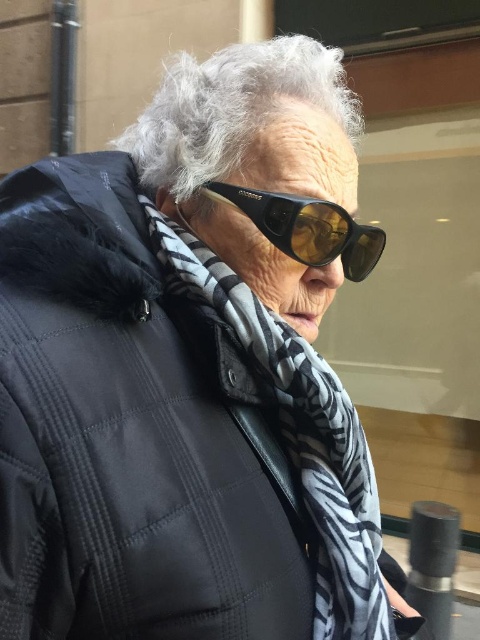
Where is the black and white patterned scarf at center located in the image?

The black and white patterned scarf at center is located at point (300, 436) in the image.

Looking at this image, in the image, there is an elderly person wearing a dark puffer jacket with a fur lined hood, a black and white scarf, and large dark sunglasses. The person has gray curly hair at upper center. You are a photographer who wants to take a close up shot of the person. To do so, you need to move closer to the point at (x=230, y=108). Is this point located on the gray curly hair at upper center?

→ Yes, the point at (x=230, y=108) is located on the gray curly hair at upper center as indicated by the description.

You are standing in a public space and want to know the distance between you and the point marked at coordinates (240,90) in the image. Can you determine this distance?

The distance between you and the point marked at coordinates (240,90) is 57.34 centimeters.